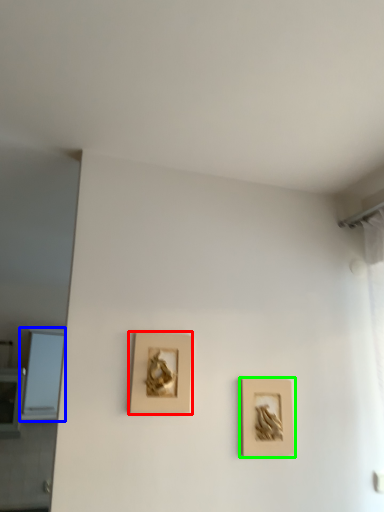
Question: Considering the real-world distances, which object is farthest from picture frame (highlighted by a red box)? window (highlighted by a blue box) or picture frame (highlighted by a green box)?

Choices:
 (A) window
 (B) picture frame

Answer: (A)